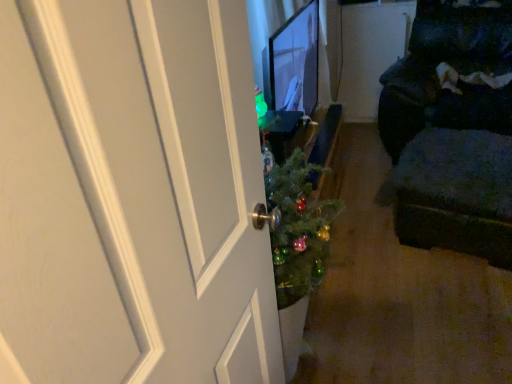
Question: Is point (505, 196) closer or farther from the camera than point (503, 19)?

Choices:
 (A) closer
 (B) farther

Answer: (A)

Question: Considering their positions, is dark fabric ottoman at right located in front of or behind dark fabric couch at right?

Choices:
 (A) front
 (B) behind

Answer: (A)

Question: Which is farther from the matte black monitor at center?

Choices:
 (A) dark fabric ottoman at right
 (B) dark fabric couch at right

Answer: (B)

Question: Estimate the real-world distances between objects in this image. Which object is closer to the matte black monitor at center?

Choices:
 (A) dark fabric ottoman at right
 (B) dark fabric couch at right

Answer: (A)